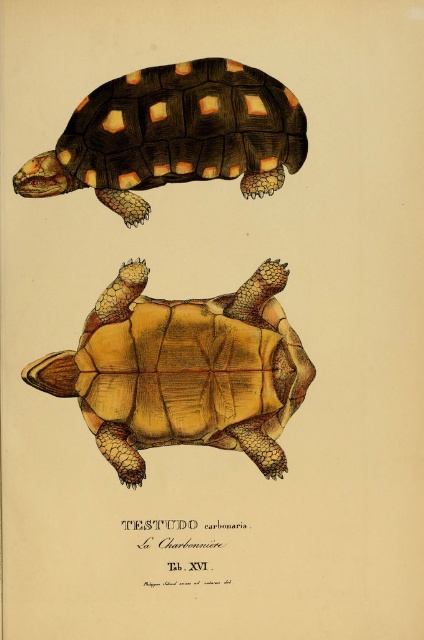
Question: Which point is farther to the camera?

Choices:
 (A) yellow matte shell at center
 (B) matte orange shell at upper left

Answer: (A)

Question: Can you confirm if yellow matte shell at center is positioned to the left of matte orange shell at upper left?

Choices:
 (A) yes
 (B) no

Answer: (B)

Question: Can you confirm if yellow matte shell at center is thinner than matte orange shell at upper left?

Choices:
 (A) no
 (B) yes

Answer: (B)

Question: Can you confirm if yellow matte shell at center is positioned below matte orange shell at upper left?

Choices:
 (A) no
 (B) yes

Answer: (B)

Question: Which object is farther from the camera taking this photo?

Choices:
 (A) yellow matte shell at center
 (B) matte orange shell at upper left

Answer: (A)